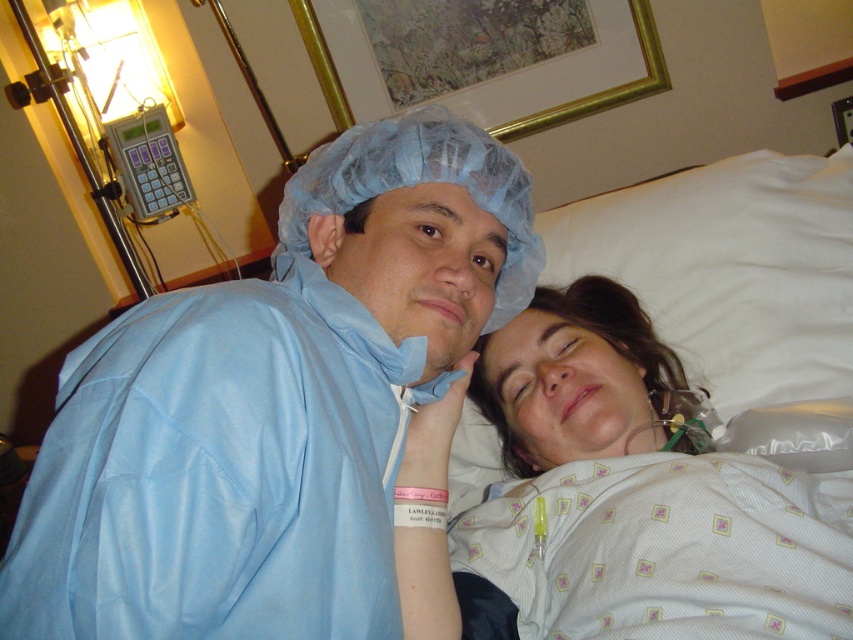
Between blue matte hospital gown at left and white textured hospital gown at center, which one is positioned higher?

blue matte hospital gown at left is higher up.

Does blue matte hospital gown at left appear over white textured hospital gown at center?

Yes, blue matte hospital gown at left is above white textured hospital gown at center.

Is point (273, 508) positioned after point (625, 291)?

No, it is in front of (625, 291).

You are a GUI agent. You are given a task and a screenshot of the screen. Output one action in this format:
    pyautogui.click(x=<x>, y=<y>)
    Task: Click on the blue matte hospital gown at left
    The height and width of the screenshot is (640, 853).
    Given the screenshot: What is the action you would take?
    pyautogui.click(x=273, y=404)